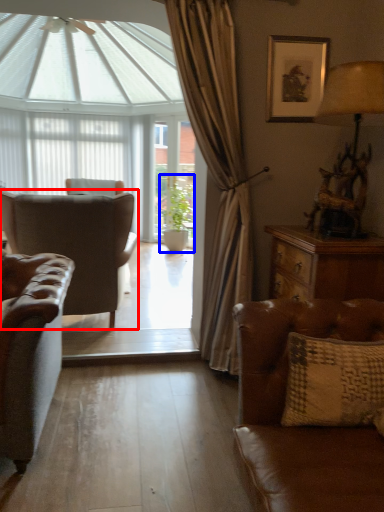
Question: Which object appears farthest to the camera in this image, chair (highlighted by a red box) or houseplant (highlighted by a blue box)?

Choices:
 (A) chair
 (B) houseplant

Answer: (B)